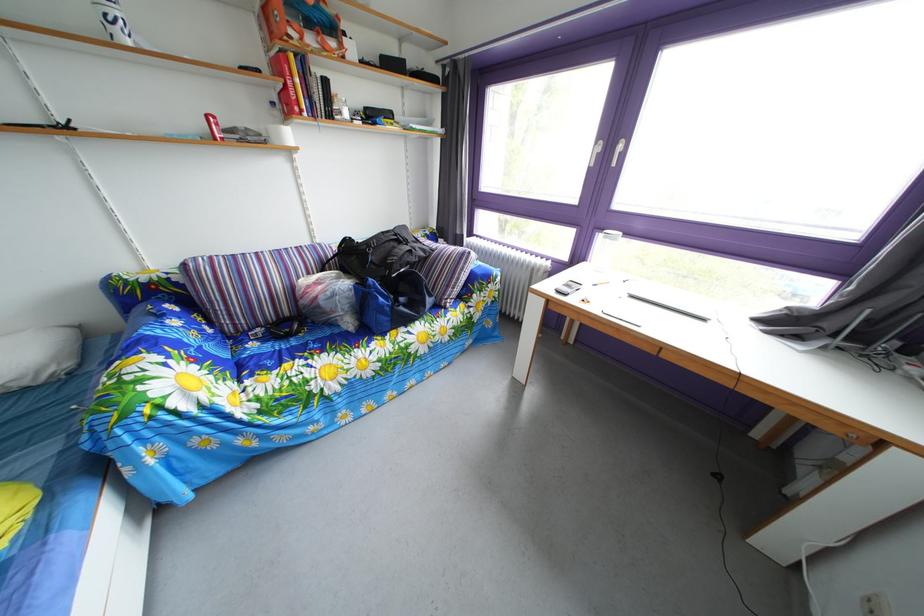
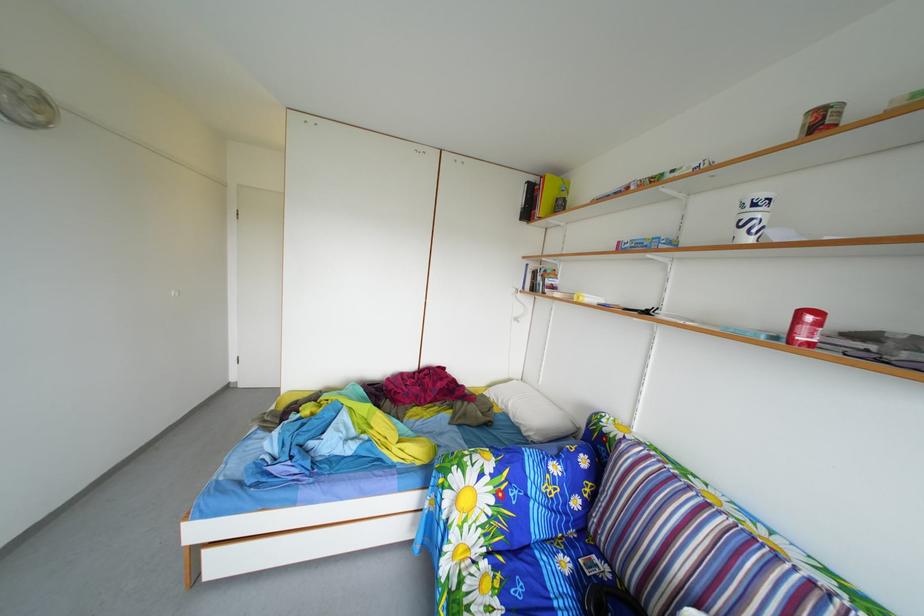
Based on the continuous images, in which direction is the camera rotating?

The camera rotated toward left-down.